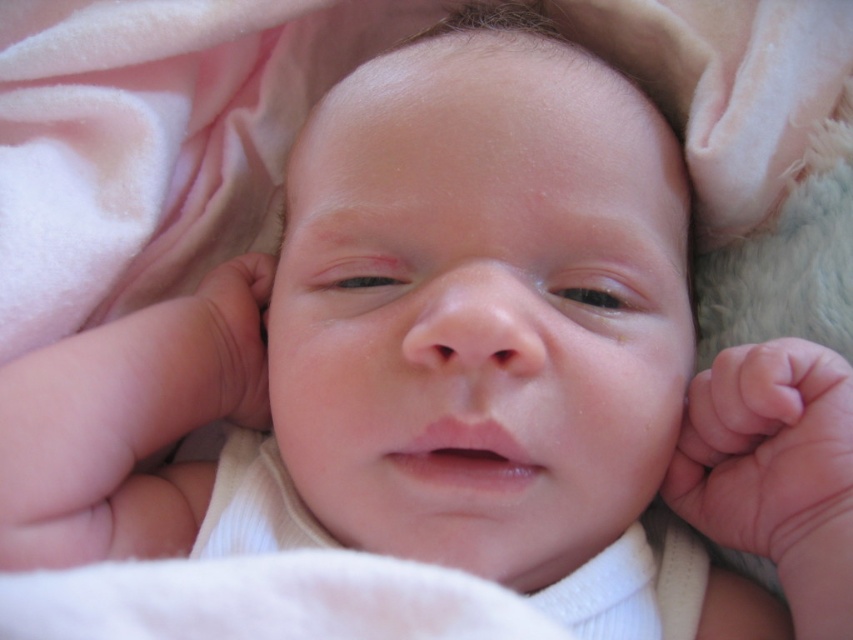
From the picture: You are a pediatrician examining the newborn. You notice two areas of pink soft skin at lower right and pink soft skin at left. Which area has a greater width?

The pink soft skin at lower right has a greater width than the pink soft skin at left.

You are a nurse examining the newborn baby. You notice two areas of pink soft skin at lower right and pink soft skin at left. Which area is positioned lower on the baby?

The pink soft skin at lower right is positioned below the pink soft skin at left, so it is lower on the baby.